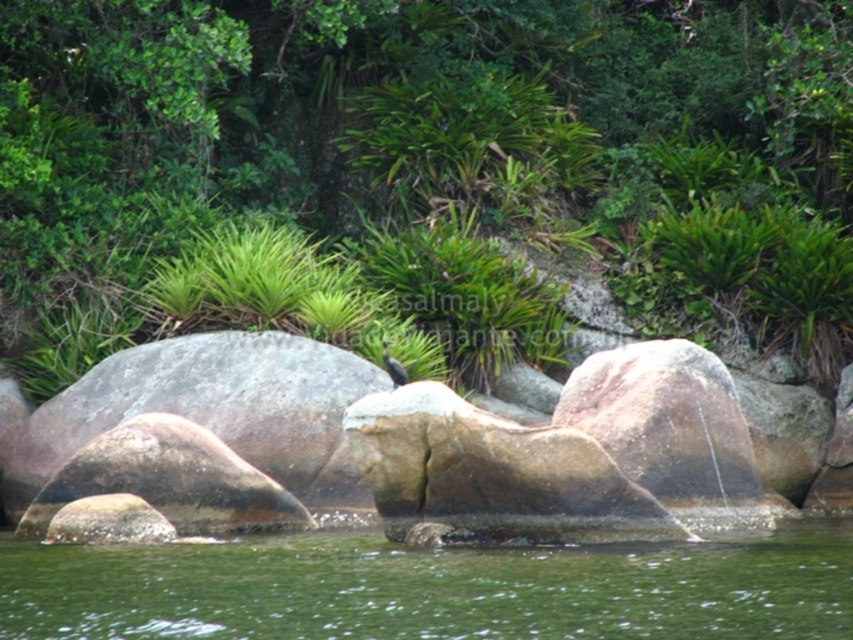
You are standing at the edge of the water in the scene and want to reach both the point at coordinates point (404,314) and the point at coordinates point (498,618). Which point will you reach first as you move forward?

You will reach point (404,314) first because it is closer to you than point (498,618), which is further away.

You are standing at the edge of the water in the image. Which object, the green leafy tree at upper left or the green water at center, is taller?

The green leafy tree at upper left is taller than the green water at center.

You are standing at the edge of the water and want to reach the green leafy tree at upper left. Which direction should you move relative to the green water at center?

To reach the green leafy tree at upper left from the edge of the green water at center, you should move to the left since the green leafy tree at upper left is positioned on the left side of the green water at center.